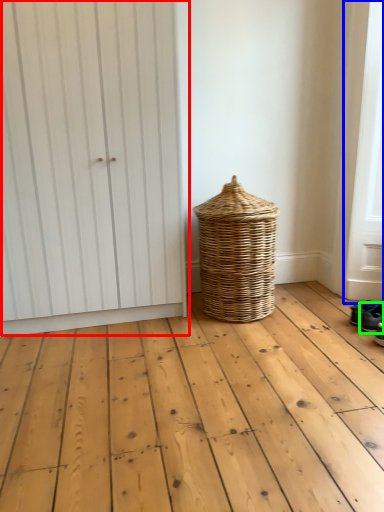
Question: Which object is the closest to the door (highlighted by a red box)? Choose among these: screen door (highlighted by a blue box) or footwear (highlighted by a green box).

Choices:
 (A) screen door
 (B) footwear

Answer: (A)